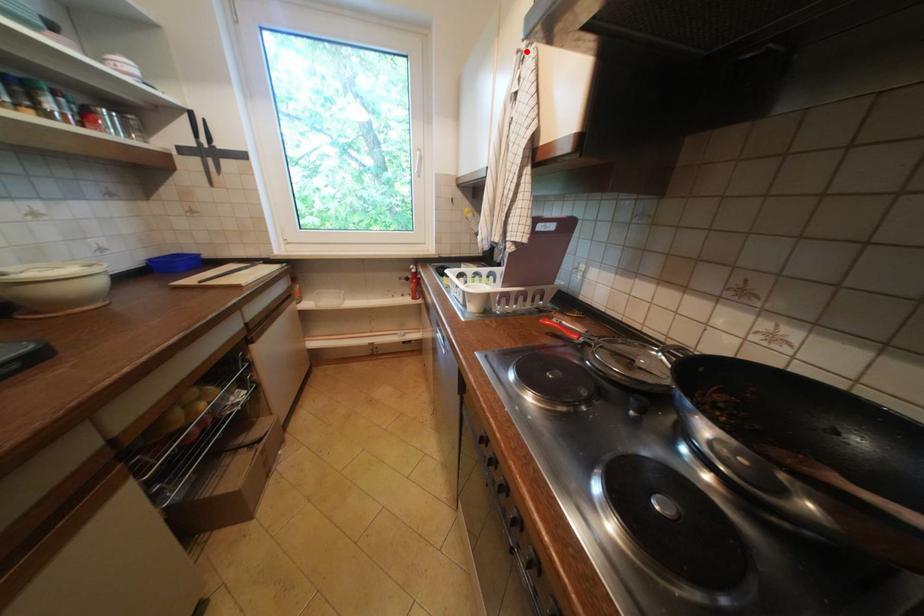
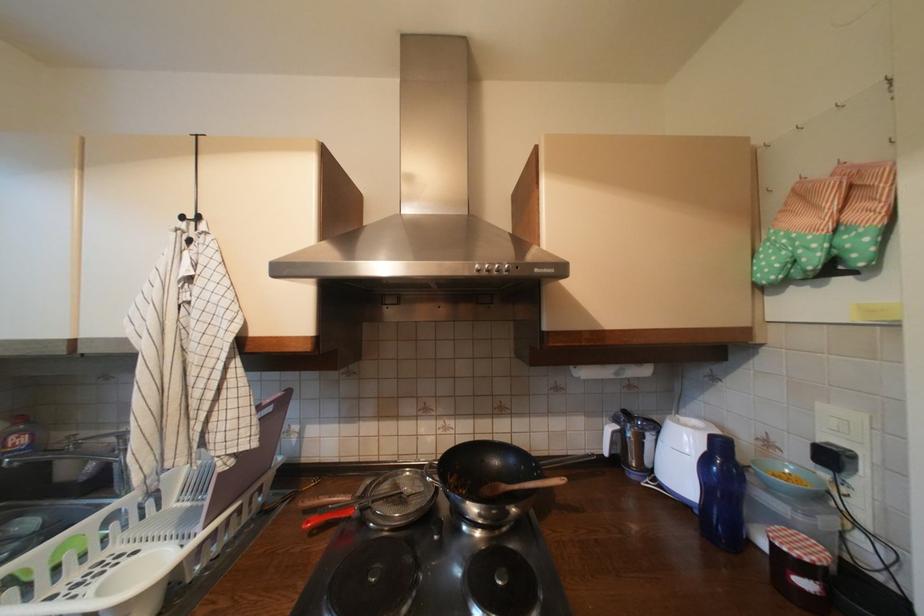
Locate, in the second image, the point that corresponds to the highlighted location in the first image.

(187, 230)